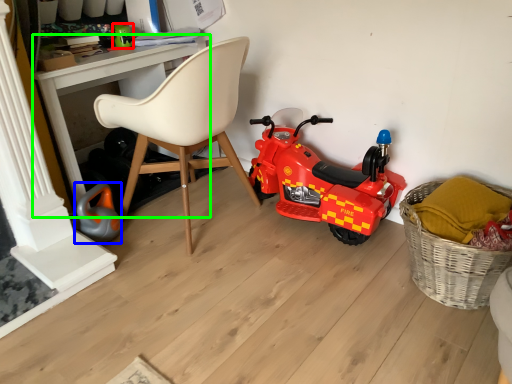
Question: Considering the real-world distances, which object is closest to toy (highlighted by a red box)? toy (highlighted by a blue box) or desk (highlighted by a green box).

Choices:
 (A) toy
 (B) desk

Answer: (B)